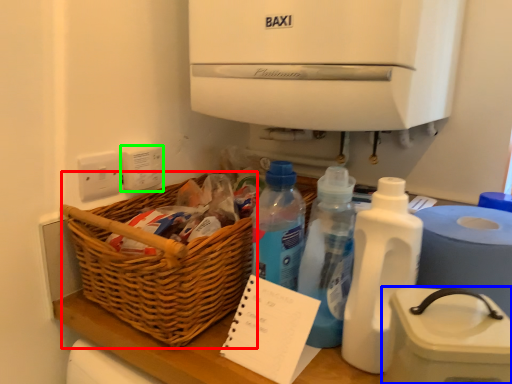
Question: Estimate the real-world distances between objects in this image. Which object is closer to basket (highlighted by a red box), appliance (highlighted by a blue box) or electric outlet (highlighted by a green box)?

Choices:
 (A) appliance
 (B) electric outlet

Answer: (B)